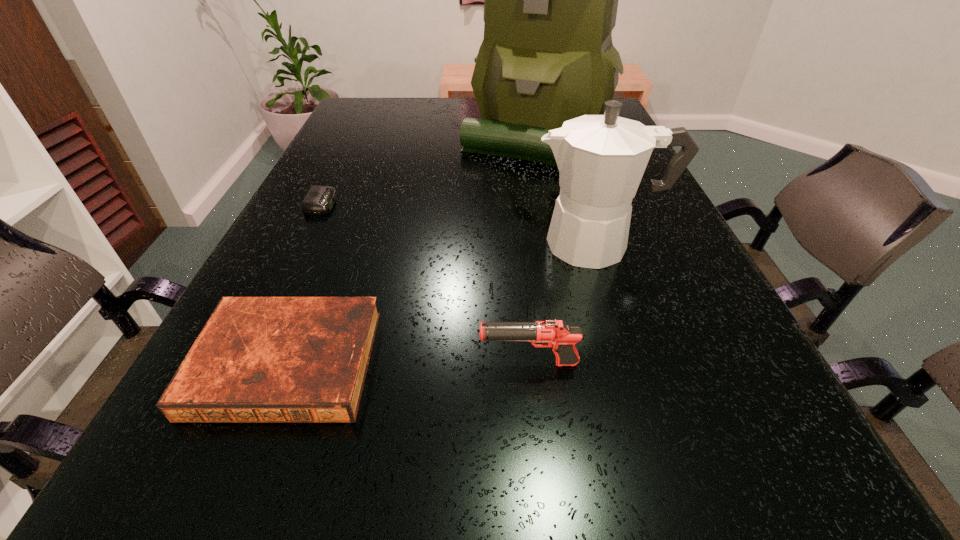
Where is `backpack positioned at the right edge`? backpack positioned at the right edge is located at coordinates (550, 0).

Where is `coffeepot at the right edge`? The image size is (960, 540). coffeepot at the right edge is located at coordinates (601, 159).

Locate an element on the screen. object located at the far right corner is located at coordinates (550, 0).

This screenshot has width=960, height=540. I want to click on free location at the far edge of the desktop, so [432, 103].

Find the location of a particular element. This screenshot has height=540, width=960. vacant space at the left edge is located at coordinates (352, 178).

Identify the location of vacant space at the right edge. (672, 382).

This screenshot has height=540, width=960. I want to click on free point at the far left corner, so click(x=362, y=122).

Identify the location of vacant space at the near right corner of the desktop. This screenshot has height=540, width=960. (756, 535).

The image size is (960, 540). Identify the location of free spot between the gun and the alarm clock. (425, 284).

Where is `vacant space that's between the Bible and the coffeepot`? The height and width of the screenshot is (540, 960). vacant space that's between the Bible and the coffeepot is located at coordinates (443, 303).